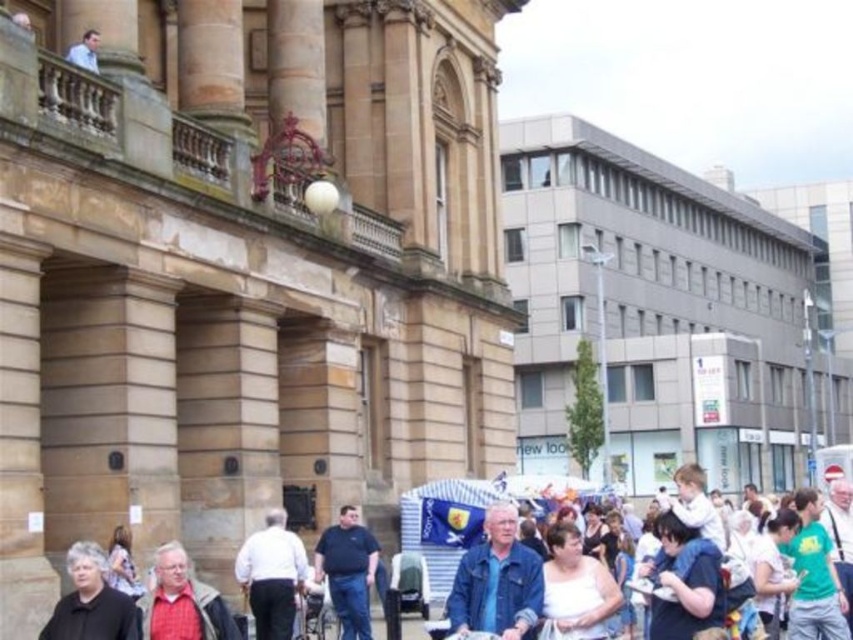
You are a photographer standing in the town square and want to capture both the white cotton shirt at lower left and the light blue shirt at upper left in the same frame. Which shirt should you focus on first to ensure both are in the frame?

The white cotton shirt at lower left is much taller than the light blue shirt at upper left, so focusing on the white cotton shirt at lower left first will ensure both are in the frame.

You are standing in the town square and see two people wearing a denim jacket at center and a dark blue shirt at center. Which one is positioned more to the right side?

The denim jacket at center is positioned more to the right side than the dark blue shirt at center.